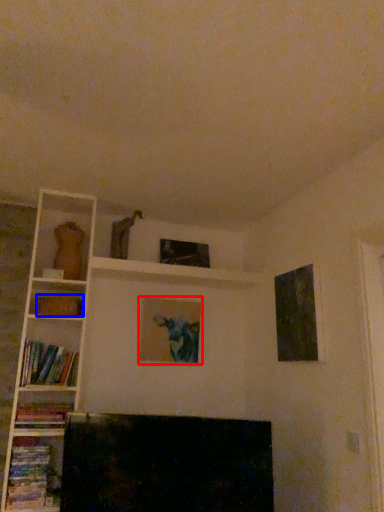
Question: Among these objects, which one is nearest to the camera, picture frame (highlighted by a red box) or paperback book (highlighted by a blue box)?

Choices:
 (A) picture frame
 (B) paperback book

Answer: (B)